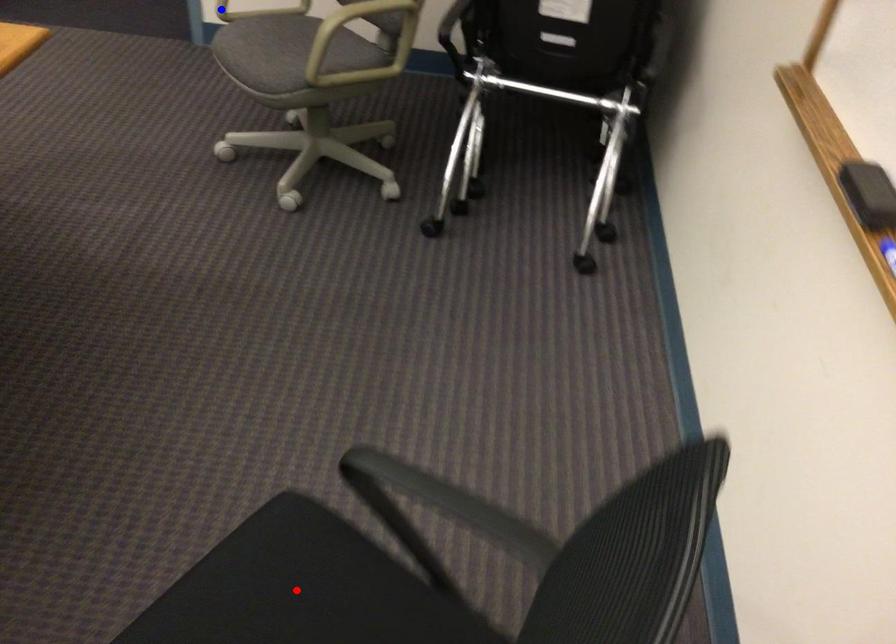
Question: Which of the two points in the image is closer to the camera?

Choices:
 (A) Blue point is closer.
 (B) Red point is closer.

Answer: (B)